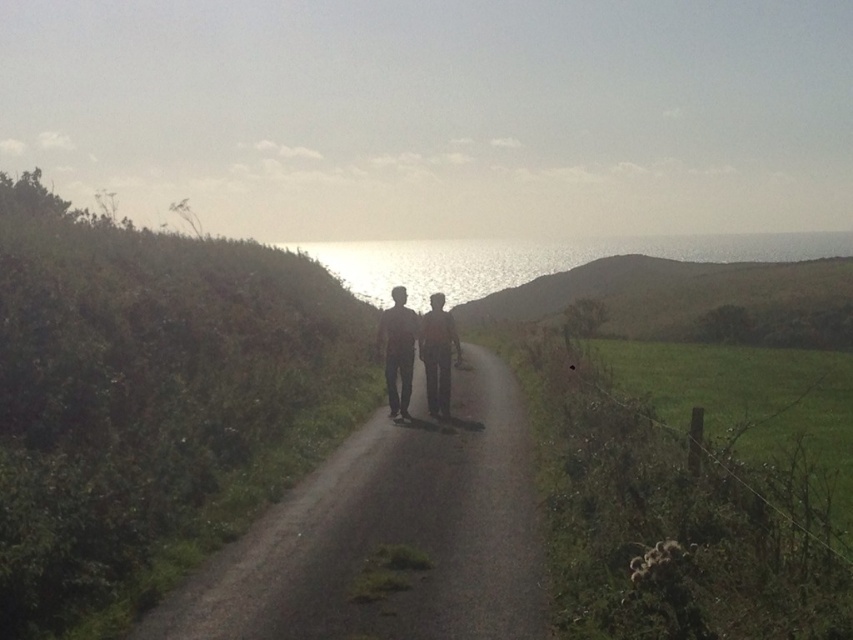
Question: Does green grassy hillside at upper center appear on the left side of brown fabric couple at center?

Choices:
 (A) yes
 (B) no

Answer: (B)

Question: Does green grassy hillside at upper center appear over brown fabric couple at center?

Choices:
 (A) yes
 (B) no

Answer: (A)

Question: Does green grassy hillside at upper center appear over matte black pants at center?

Choices:
 (A) yes
 (B) no

Answer: (A)

Question: Which point appears closest to the camera in this image?

Choices:
 (A) (407, 406)
 (B) (430, 339)
 (C) (682, 310)
 (D) (410, 326)

Answer: (D)

Question: Which object is positioned farthest from the green grassy hillside at upper center?

Choices:
 (A) brown fabric couple at center
 (B) dull gray asphalt road at center
 (C) dark brown leather jacket at center
 (D) matte black pants at center

Answer: (B)

Question: Considering the real-world distances, which object is closest to the matte black pants at center?

Choices:
 (A) brown fabric couple at center
 (B) green grassy hillside at upper center

Answer: (A)